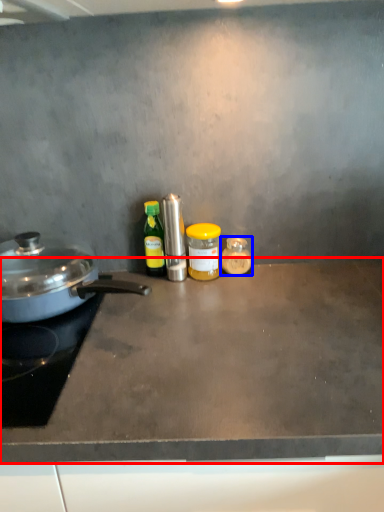
Question: Among these objects, which one is nearest to the camera, countertop (highlighted by a red box) or kitchen appliance (highlighted by a blue box)?

Choices:
 (A) countertop
 (B) kitchen appliance

Answer: (A)